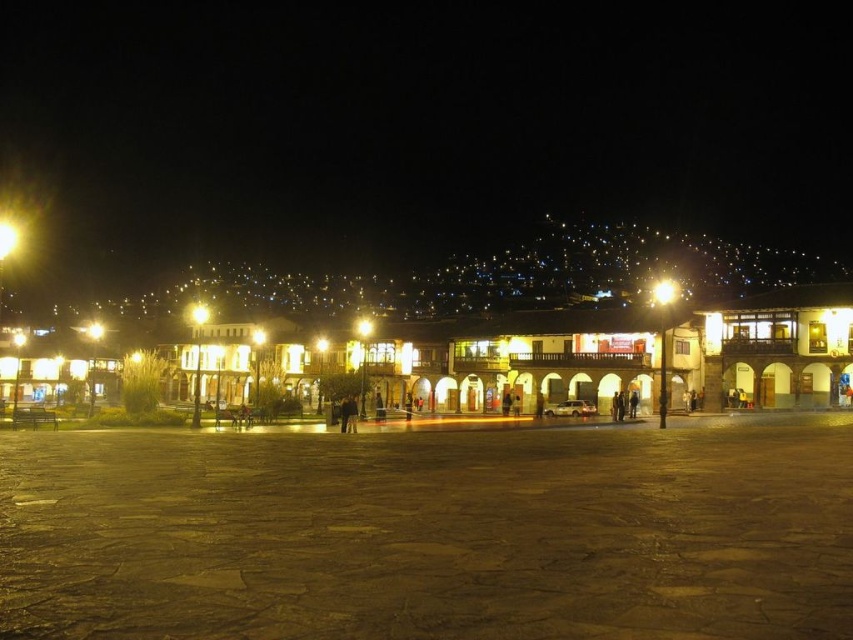
You are standing in the plaza and want to take a photo of the point at coordinates [670,284]. If your camera has a maximum focus range of 150 meters, will it be able to focus on that point?

The point at coordinates [670,284] is 186.40 meters away from the viewer. Since this distance exceeds the camera maximum focus range of 150 meters, the camera will not be able to focus on that point.

You are a delivery drone with a maximum flight range of 150 meters. You need to deliver a package from the brown stone pavement at center to the yellow metallic streetlight at left. Can you complete the delivery without needing a recharge?

The distance between the brown stone pavement at center and the yellow metallic streetlight at left is 151.18 meters, which exceeds the drone s 150 meter range. Therefore, the drone cannot complete the delivery without recharging.

You are standing at the point marked as point (430,532) in the image. What is the material of the surface you are currently standing on?

The point (430,532) indicates brown stone pavement at center, so the surface is made of brown stone pavement.